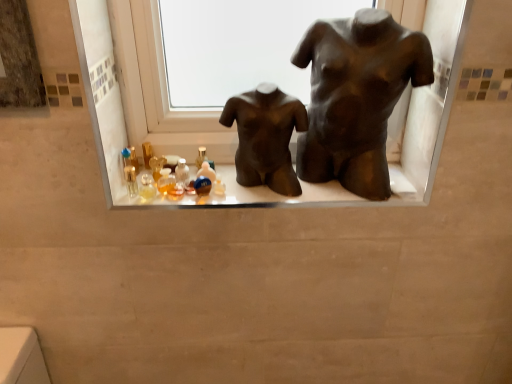
Question: Is bronze statue at center, acting as the 1th statue (sculpture) starting from the left, at the right side of matte black mannequins at center?

Choices:
 (A) no
 (B) yes

Answer: (A)

Question: Is the depth of bronze statue at center, the second statue (sculpture) from the right, less than that of matte black mannequins at center?

Choices:
 (A) no
 (B) yes

Answer: (B)

Question: From the image's perspective, is bronze statue at center, acting as the 1th statue (sculpture) starting from the left, under matte black mannequins at center?

Choices:
 (A) yes
 (B) no

Answer: (B)

Question: Is bronze statue at center, acting as the 1th statue (sculpture) starting from the left, to the left of matte black mannequins at center from the viewer's perspective?

Choices:
 (A) yes
 (B) no

Answer: (A)

Question: Can you confirm if bronze statue at center, the second statue (sculpture) from the right, is taller than matte black mannequins at center?

Choices:
 (A) no
 (B) yes

Answer: (B)

Question: Can you see bronze statue at center, the second statue (sculpture) from the right, touching matte black mannequins at center?

Choices:
 (A) no
 (B) yes

Answer: (B)

Question: Can you confirm if matte black mannequins at center is shorter than bronze/statue at center, marked as the first statue (sculpture) in a right-to-left arrangement?

Choices:
 (A) yes
 (B) no

Answer: (A)

Question: Is matte black mannequins at center taller than bronze/statue at center, marked as the first statue (sculpture) in a right-to-left arrangement?

Choices:
 (A) no
 (B) yes

Answer: (A)

Question: From the image's perspective, is matte black mannequins at center beneath bronze/statue at center, marked as the first statue (sculpture) in a right-to-left arrangement?

Choices:
 (A) no
 (B) yes

Answer: (B)

Question: Is matte black mannequins at center facing towards bronze/statue at center, marked as the first statue (sculpture) in a right-to-left arrangement?

Choices:
 (A) yes
 (B) no

Answer: (B)

Question: Is matte black mannequins at center bigger than bronze/statue at center, acting as the 2th statue (sculpture) starting from the left?

Choices:
 (A) no
 (B) yes

Answer: (A)

Question: From the image's perspective, is matte black mannequins at center over bronze/statue at center, marked as the first statue (sculpture) in a right-to-left arrangement?

Choices:
 (A) no
 (B) yes

Answer: (A)

Question: Is matte black mannequins at center not inside bronze statue at center, acting as the 1th statue (sculpture) starting from the left?

Choices:
 (A) yes
 (B) no

Answer: (A)